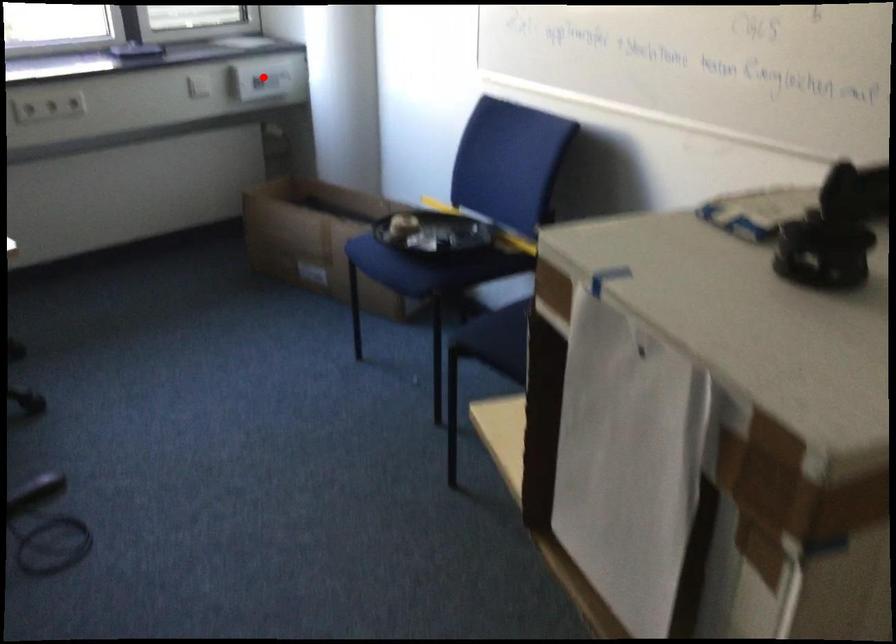
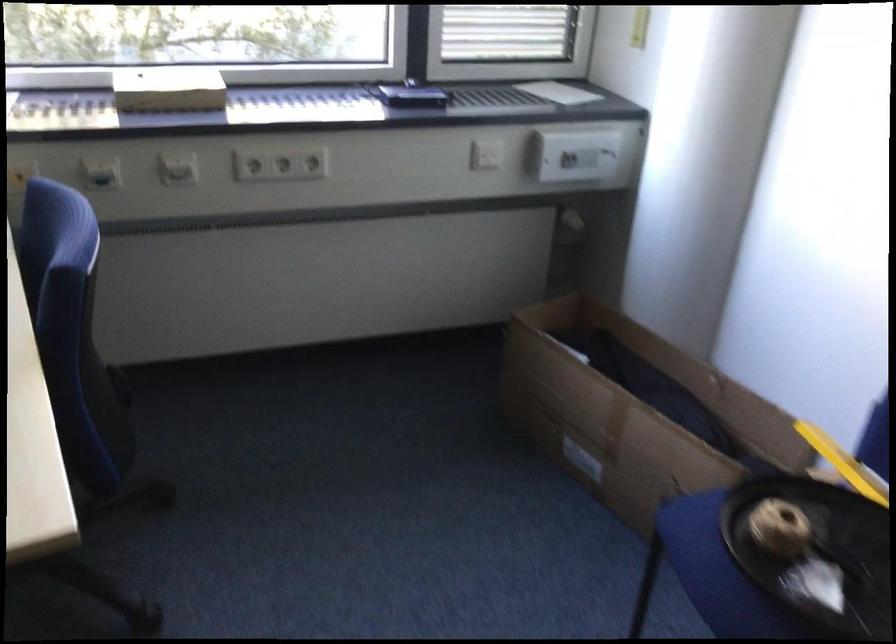
Locate, in the second image, the point that corresponds to the highlighted location in the first image.

(576, 155)